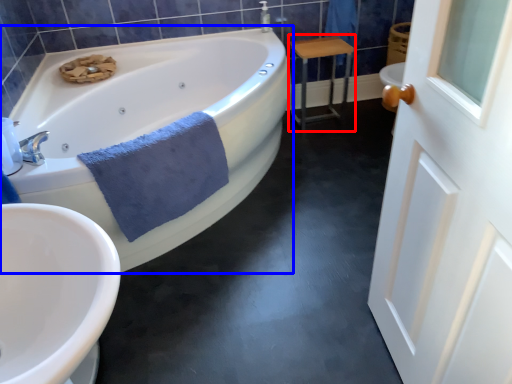
Question: Which object appears closest to the camera in this image, table (highlighted by a red box) or bathtub (highlighted by a blue box)?

Choices:
 (A) table
 (B) bathtub

Answer: (B)